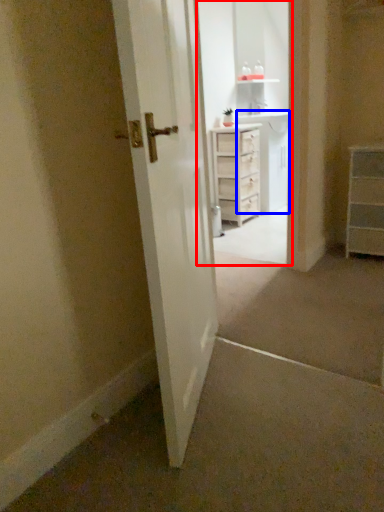
Question: Which object is further to the camera taking this photo, entertainment center (highlighted by a red box) or cabinetry (highlighted by a blue box)?

Choices:
 (A) entertainment center
 (B) cabinetry

Answer: (B)